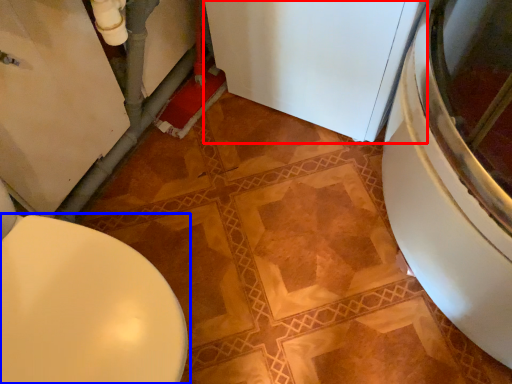
Question: Which of the following is the closest to the observer, appliance (highlighted by a red box) or toilet (highlighted by a blue box)?

Choices:
 (A) appliance
 (B) toilet

Answer: (B)